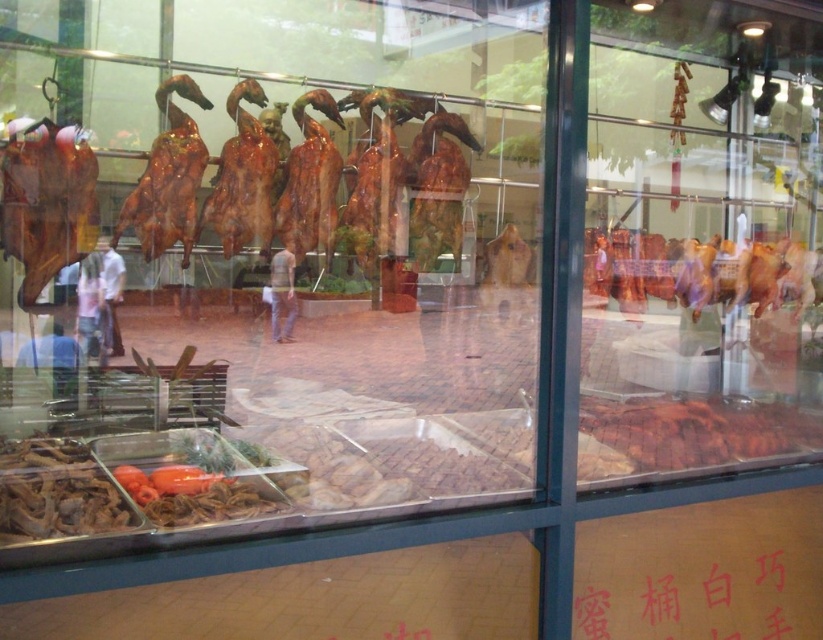
You are a customer looking at the display window of the food stall. You want to order the shiny brown duck at left and the pink glossy chicken at center. Which one is closer to the left side of the window?

The shiny brown duck at left is closer to the left side of the window because it is positioned to the left of the pink glossy chicken at center.

You are standing in front of the food stall display window. There is a point at coordinates point (710, 636) that you want to reach with your hand. Considering your arm can extend 2 meters, can you reach that point?

The point (710, 636) is 6.55 feet away from you. Since your arm can extend 2 meters, which is approximately 6.56 feet, you can barely reach the point (710, 636) with your hand.